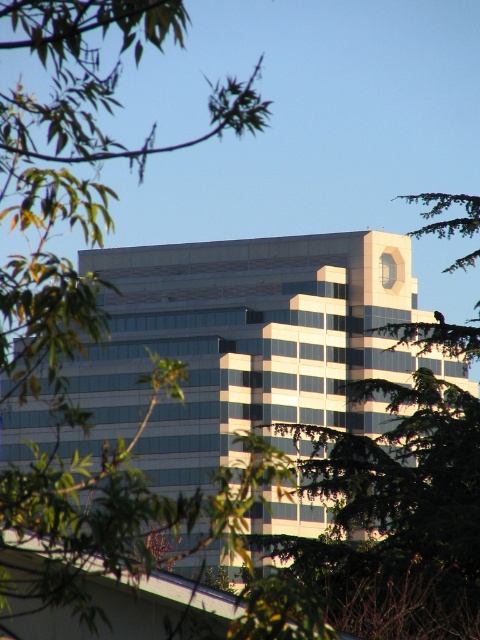
Question: Which point is farther from the camera taking this photo?

Choices:
 (A) (22, 100)
 (B) (372, 429)

Answer: (B)

Question: Is white glass building at center positioned before green leafy tree at upper left?

Choices:
 (A) no
 (B) yes

Answer: (A)

Question: Is white glass building at center below green leafy tree at upper left?

Choices:
 (A) no
 (B) yes

Answer: (B)

Question: Which of the following is the farthest from the observer?

Choices:
 (A) (109, 566)
 (B) (249, 397)

Answer: (B)

Question: Does white glass building at center have a larger size compared to green leafy tree at upper left?

Choices:
 (A) yes
 (B) no

Answer: (B)

Question: Which object is farther from the camera taking this photo?

Choices:
 (A) white glass building at center
 (B) green leafy tree at upper left

Answer: (A)